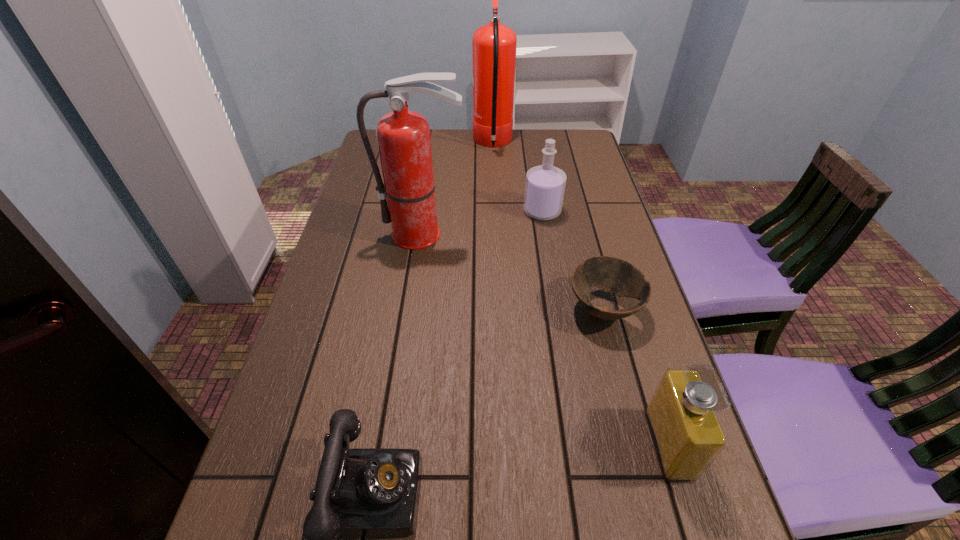
You are a GUI agent. You are given a task and a screenshot of the screen. Output one action in this format:
    pyautogui.click(x=<x>, y=<y>)
    Task: Click on the farthest object
    This screenshot has width=960, height=540.
    Given the screenshot: What is the action you would take?
    pyautogui.click(x=494, y=45)

Where is `the right fire extinguisher`? the right fire extinguisher is located at coordinates (494, 45).

Locate an element on the screen. The height and width of the screenshot is (540, 960). the nearer fire extinguisher is located at coordinates (403, 137).

Locate an element on the screen. the left perfume is located at coordinates (545, 184).

Image resolution: width=960 pixels, height=540 pixels. I want to click on the right perfume, so click(x=688, y=436).

Find the location of `the third nearest object`. the third nearest object is located at coordinates (616, 276).

Locate an element on the screen. bowl is located at coordinates (616, 276).

The width and height of the screenshot is (960, 540). Find the location of `vacant position located towards the nozzle of the farther fire extinguisher`. vacant position located towards the nozzle of the farther fire extinguisher is located at coordinates (456, 144).

The height and width of the screenshot is (540, 960). Identify the location of free space located towards the nozzle of the farther fire extinguisher. (376, 144).

This screenshot has width=960, height=540. I want to click on free space located 0.360m towards the nozzle of the farther fire extinguisher, so click(x=373, y=144).